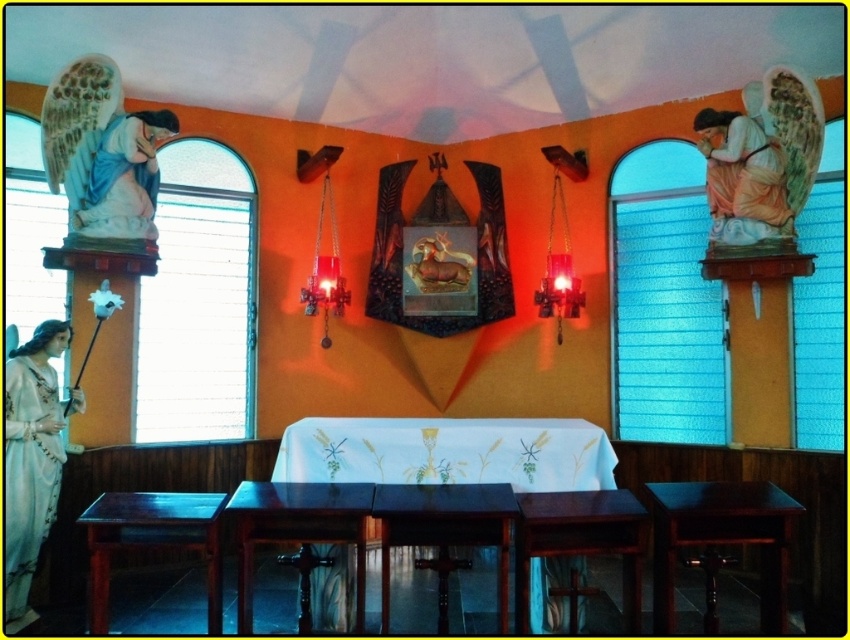
Question: Which point appears farthest from the camera in this image?

Choices:
 (A) (412, 513)
 (B) (360, 568)
 (C) (786, 525)

Answer: (B)

Question: Is dark wood table at center closer to the viewer compared to matte peach robe at upper right?

Choices:
 (A) no
 (B) yes

Answer: (B)

Question: Which object appears closest to the camera in this image?

Choices:
 (A) dark wood table at center
 (B) mahogany wood table at lower left

Answer: (B)

Question: Among these objects, which one is nearest to the camera?

Choices:
 (A) white embroidered tablecloth at center
 (B) mahogany wood table at center
 (C) mahogany wood table at lower left

Answer: (C)

Question: Can you confirm if white embroidered tablecloth at center is wider than glossy dark wood table at center?

Choices:
 (A) no
 (B) yes

Answer: (B)

Question: Is white embroidered tablecloth at center to the left of dark wood table at center from the viewer's perspective?

Choices:
 (A) yes
 (B) no

Answer: (A)